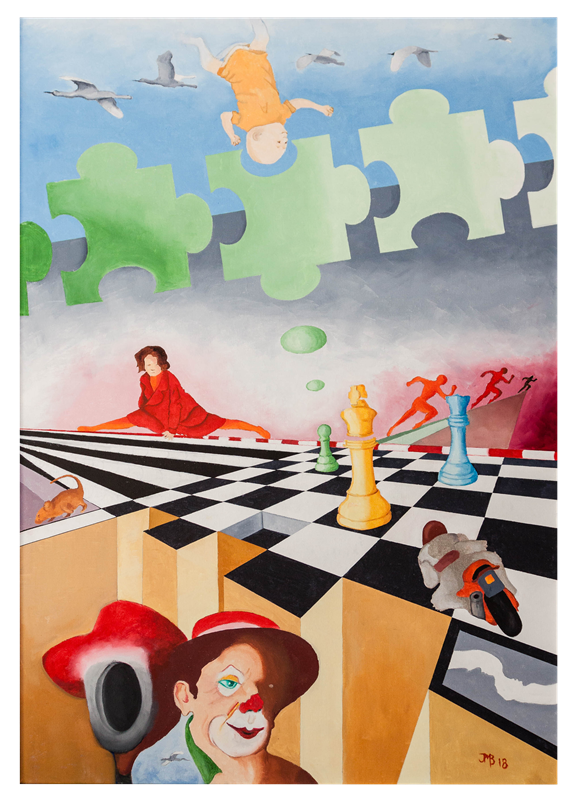
In order to click on artwork in this screenshot , I will do `click(280, 372)`.